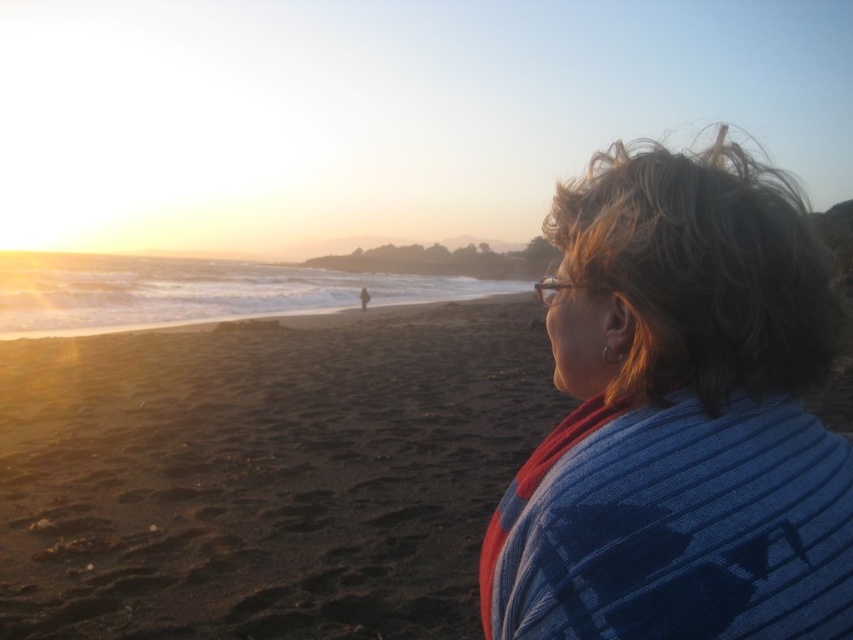
Question: Does dark sand at lower left appear under blue knitted sweater at upper right?

Choices:
 (A) yes
 (B) no

Answer: (B)

Question: Which point is farther to the camera?

Choices:
 (A) (778, 632)
 (B) (202, 528)

Answer: (B)

Question: Is dark sand at lower left wider than blue knitted sweater at upper right?

Choices:
 (A) yes
 (B) no

Answer: (A)

Question: Which object is closer to the camera taking this photo?

Choices:
 (A) blue knitted sweater at upper right
 (B) dark sand at lower left

Answer: (A)

Question: Can you confirm if dark sand at lower left is smaller than blue knitted sweater at upper right?

Choices:
 (A) yes
 (B) no

Answer: (B)